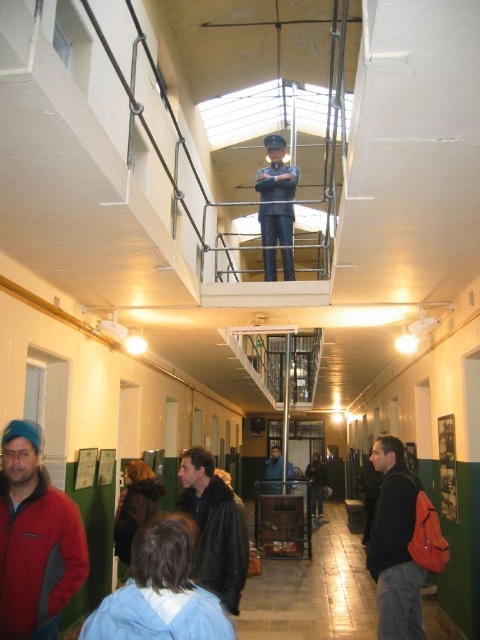
Question: Does uniformed officer at upper center have a greater width compared to dark blue uniform at center?

Choices:
 (A) yes
 (B) no

Answer: (A)

Question: Does brushed red jacket at lower left appear on the left side of dark blue uniform at center?

Choices:
 (A) no
 (B) yes

Answer: (B)

Question: Among these points, which one is farthest from the camera?

Choices:
 (A) (315, 477)
 (B) (34, 520)
 (C) (381, 444)

Answer: (A)

Question: Which point is farther from the camera taking this photo?

Choices:
 (A) (275, 141)
 (B) (32, 496)
 (C) (408, 628)
 (D) (312, 502)

Answer: (D)

Question: Is the position of matte black jacket at lower right less distant than that of dark blue uniform at center?

Choices:
 (A) yes
 (B) no

Answer: (A)

Question: Which point is farther from the camera taking this photo?

Choices:
 (A) 190,483
 (B) 12,550
 (C) 268,248
 (D) 324,472

Answer: (D)